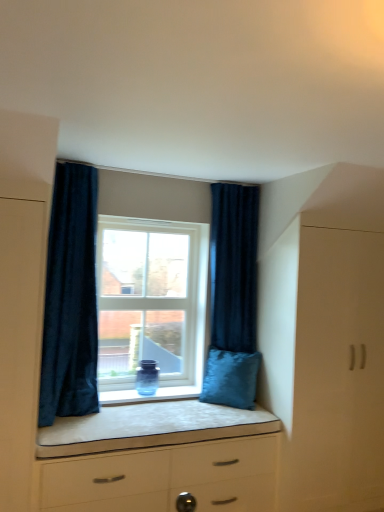
Question: Is dark blue velvet curtain at right, the second curtain from the left, next to clear glass window at center and touching it?

Choices:
 (A) no
 (B) yes

Answer: (A)

Question: Considering the relative sizes of dark blue velvet curtain at right, acting as the first curtain starting from the back, and clear glass window at center in the image provided, is dark blue velvet curtain at right, acting as the first curtain starting from the back, shorter than clear glass window at center?

Choices:
 (A) yes
 (B) no

Answer: (B)

Question: Can you confirm if dark blue velvet curtain at right, the second curtain from the left, is positioned to the right of clear glass window at center?

Choices:
 (A) no
 (B) yes

Answer: (B)

Question: Does dark blue velvet curtain at right, which is the second curtain from front to back, have a lesser width compared to clear glass window at center?

Choices:
 (A) yes
 (B) no

Answer: (B)

Question: From a real-world perspective, is dark blue velvet curtain at right, the second curtain from the left, on top of clear glass window at center?

Choices:
 (A) yes
 (B) no

Answer: (A)

Question: Could you tell me if dark blue velvet curtain at right, which is the second curtain from front to back, is turned towards clear glass window at center?

Choices:
 (A) no
 (B) yes

Answer: (A)

Question: Does dark blue velvet curtain at right, which is the second curtain from front to back, have a greater width compared to velvet blue pillow at lower right?

Choices:
 (A) no
 (B) yes

Answer: (A)

Question: Does dark blue velvet curtain at right, the second curtain from the left, have a lesser height compared to velvet blue pillow at lower right?

Choices:
 (A) yes
 (B) no

Answer: (B)

Question: Does dark blue velvet curtain at right, the 1th curtain positioned from the right, have a lesser width compared to velvet blue pillow at lower right?

Choices:
 (A) no
 (B) yes

Answer: (B)

Question: Is the position of dark blue velvet curtain at right, the second curtain from the left, more distant than that of velvet blue pillow at lower right?

Choices:
 (A) yes
 (B) no

Answer: (A)

Question: Is dark blue velvet curtain at right, the 1th curtain positioned from the right, surrounding velvet blue pillow at lower right?

Choices:
 (A) yes
 (B) no

Answer: (A)

Question: Can you confirm if dark blue velvet curtain at right, the second curtain from the left, is bigger than velvet blue pillow at lower right?

Choices:
 (A) no
 (B) yes

Answer: (B)

Question: From a real-world perspective, is dark blue velvet curtain at right, which is the second curtain from front to back, on white matte cabinet at right?

Choices:
 (A) no
 (B) yes

Answer: (B)